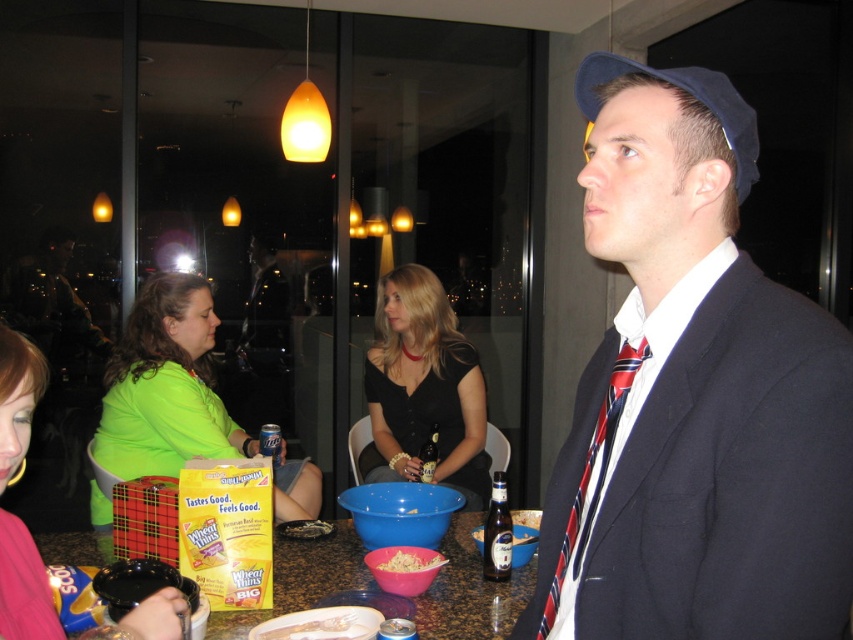
You are a waiter at the restaurant. A customer asks you to describe the position of the shiny plastic bowl at center and the brown glass beer at center on the table. How would you describe their arrangement?

The shiny plastic bowl at center is placed below the brown glass beer at center on the table.

You are a server at the restaurant and need to place a new dish on the table. The dish is 3 inches tall. Can you put it on the table without knocking over either the shiny plastic bowl at center or the brown glass beer at center?

The shiny plastic bowl at center has a lesser height compared to brown glass beer at center, but since the dish is only 3 inches tall, it should be safe to place it on the table as long as it doesn not directly interfere with the existing items.

You are a photographer taking a picture of the neon green shirt at lower left and the blue fabric hat at upper right. Which object should you focus on first if you want to capture both in the same frame without moving the camera?

The neon green shirt at lower left should be focused on first because it has a greater height compared to the blue fabric hat at upper right, making it more prominent in the frame.